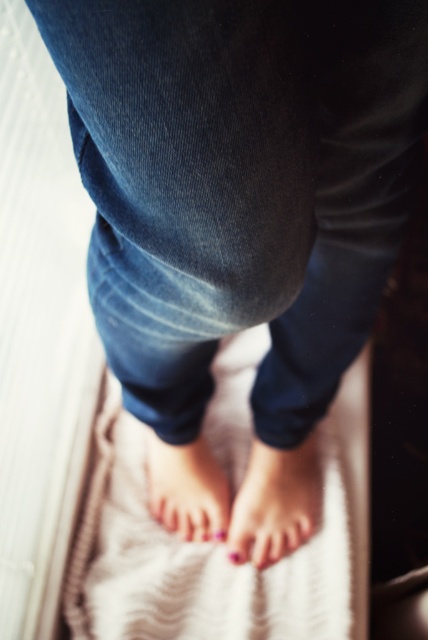
You are a physical therapist assessing a patient who is standing on a textured beige mat at center and has pink polished toenails at lower center. Based on the scene, which object is positioned higher relative to the other?

The textured beige mat at center is above the pink polished toenails at lower center, so the textured beige mat at center is positioned higher.